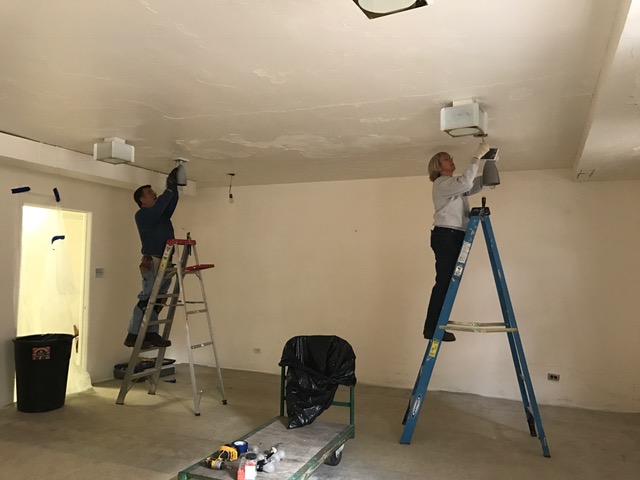
Identify the location of roll of tape. (240, 447).